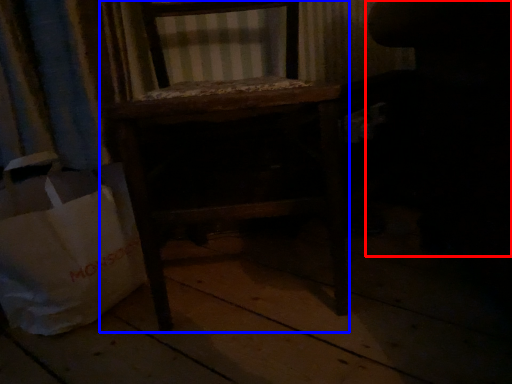
Question: Which object appears farthest to the camera in this image, swivel chair (highlighted by a red box) or furniture (highlighted by a blue box)?

Choices:
 (A) swivel chair
 (B) furniture

Answer: (A)